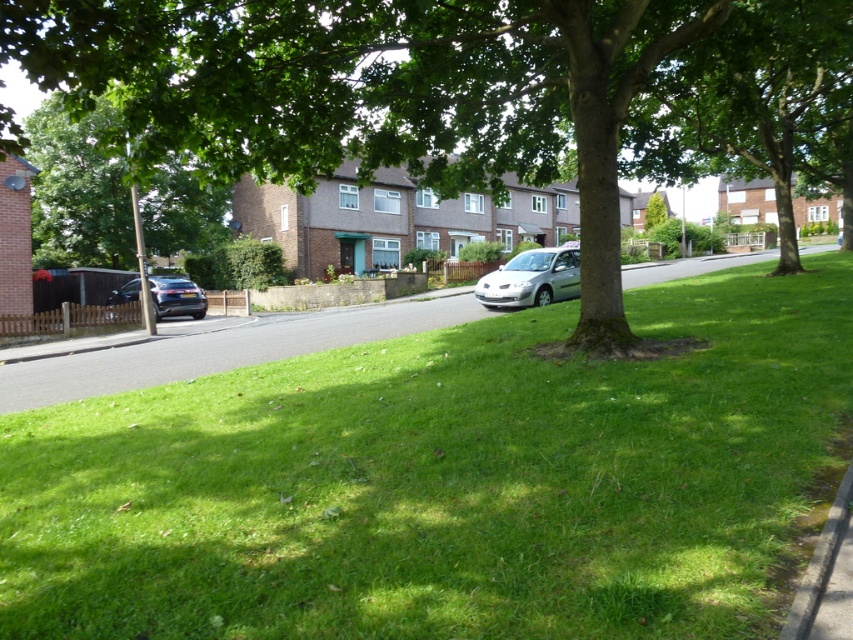
Question: In this image, where is green leafy tree at center located relative to green grass at lower center?

Choices:
 (A) right
 (B) left

Answer: (B)

Question: Observing the image, what is the correct spatial positioning of satin silver car at center in reference to gray concrete curb at lower right?

Choices:
 (A) below
 (B) above

Answer: (B)

Question: Is green grassy at center to the right of gray concrete curb at lower right from the viewer's perspective?

Choices:
 (A) yes
 (B) no

Answer: (B)

Question: Which object appears closest to the camera in this image?

Choices:
 (A) gray concrete curb at lower right
 (B) green leafy tree at center
 (C) satin silver car at center
 (D) green grassy at center

Answer: (A)

Question: Which object is farther from the camera taking this photo?

Choices:
 (A) satin black car at left
 (B) satin silver car at center

Answer: (A)

Question: Which object is positioned farthest from the green leafy tree at center?

Choices:
 (A) green leafy tree at upper left
 (B) satin silver car at center

Answer: (A)